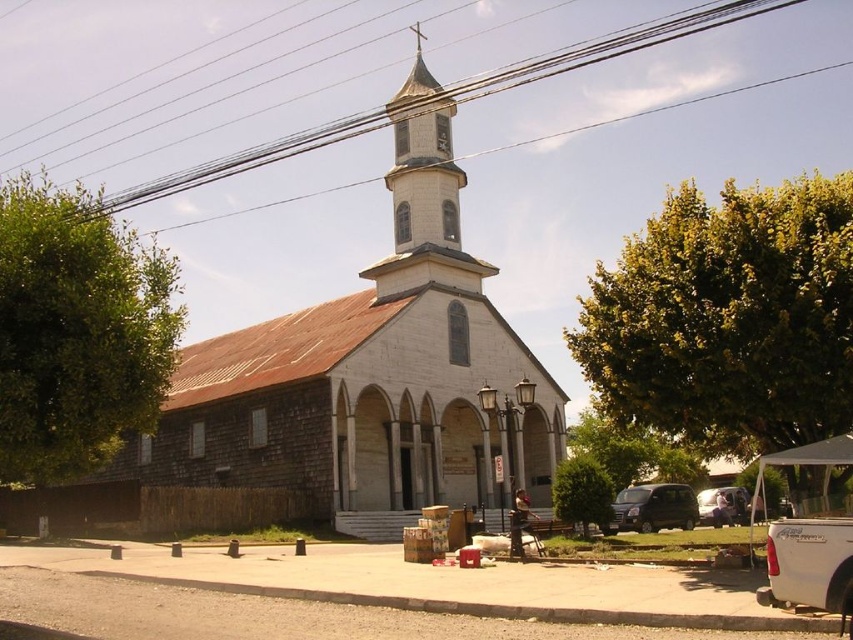
Is metallic wire at upper center thinner than metallic silver van at lower right?

Incorrect, metallic wire at upper center's width is not less than metallic silver van at lower right's.

Which is behind, point (566, 64) or point (734, 509)?

Positioned behind is point (566, 64).

Image resolution: width=853 pixels, height=640 pixels. I want to click on metallic wire at upper center, so click(x=444, y=99).

Between white stone bell tower at upper center and white matte truck at lower right, which one has less height?

white matte truck at lower right

Which is in front, point (413, 97) or point (845, 540)?

Point (845, 540)

Identify the location of white stone bell tower at upper center. tap(422, 163).

Is white wood church at center smaller than matte black van at lower right?

No, white wood church at center is not smaller than matte black van at lower right.

Does white wood church at center appear on the left side of matte black van at lower right?

Indeed, white wood church at center is positioned on the left side of matte black van at lower right.

Find the location of a particular element. The height and width of the screenshot is (640, 853). white wood church at center is located at coordinates point(366,378).